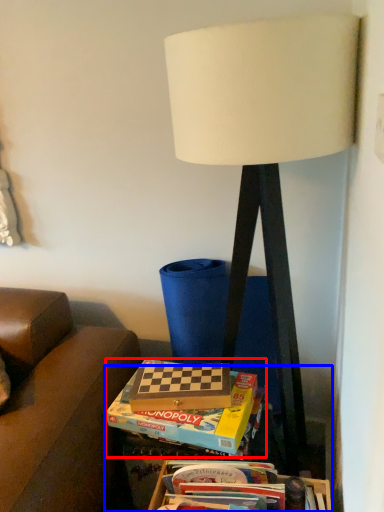
Question: Among these objects, which one is nearest to the camera, box (highlighted by a red box) or table (highlighted by a blue box)?

Choices:
 (A) box
 (B) table

Answer: (A)